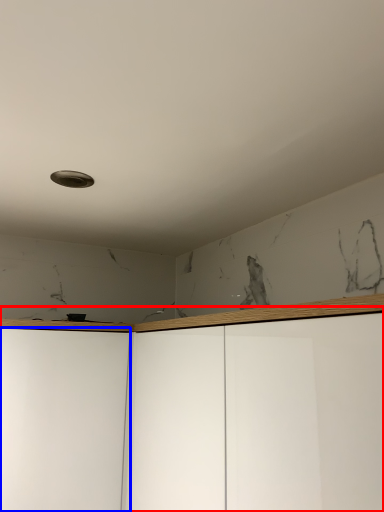
Question: Which of the following is the farthest to the observer, dresser (highlighted by a red box) or glass door (highlighted by a blue box)?

Choices:
 (A) dresser
 (B) glass door

Answer: (B)